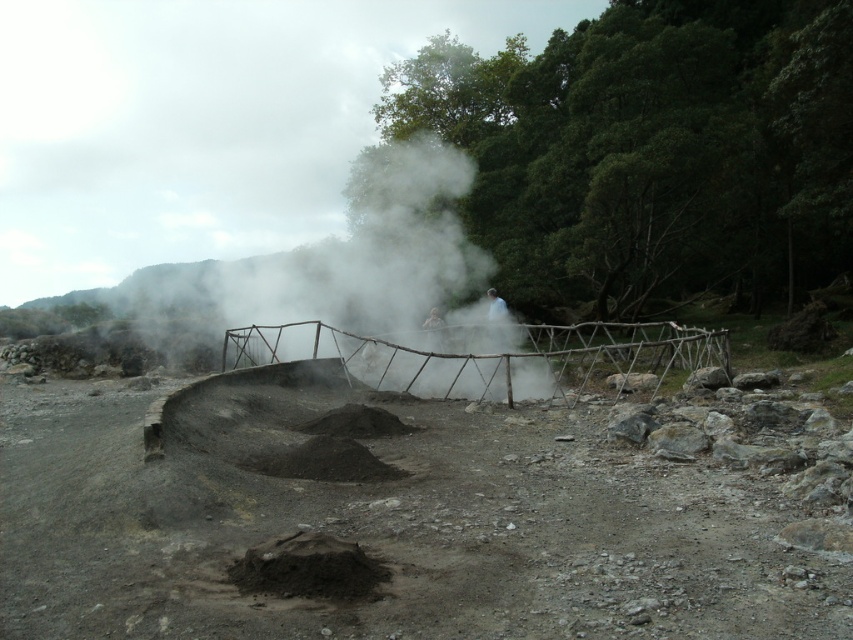
In the scene shown: You are a park ranger who needs to place a warning sign 5 meters away from the dark gray ash at center. Can you place it near the wooden fence at center?

The wooden fence at center is 5.30 meters away from the dark gray ash at center, so placing the warning sign near the wooden fence at center would be slightly beyond the desired 5 meter distance.

You are a park ranger assessing the safety of the geothermal area. You notice the white vapor at center and the dark gray ash at center. Which of these two features is positioned higher in the scene?

The white vapor at center is above the dark gray ash at center, so it is positioned higher in the scene.

You are standing at the edge of the geothermal area and want to locate the dull gray dirt track at center. According to the coordinates provided, where should you look to find it?

The dull gray dirt track at center is located at point (410, 516).